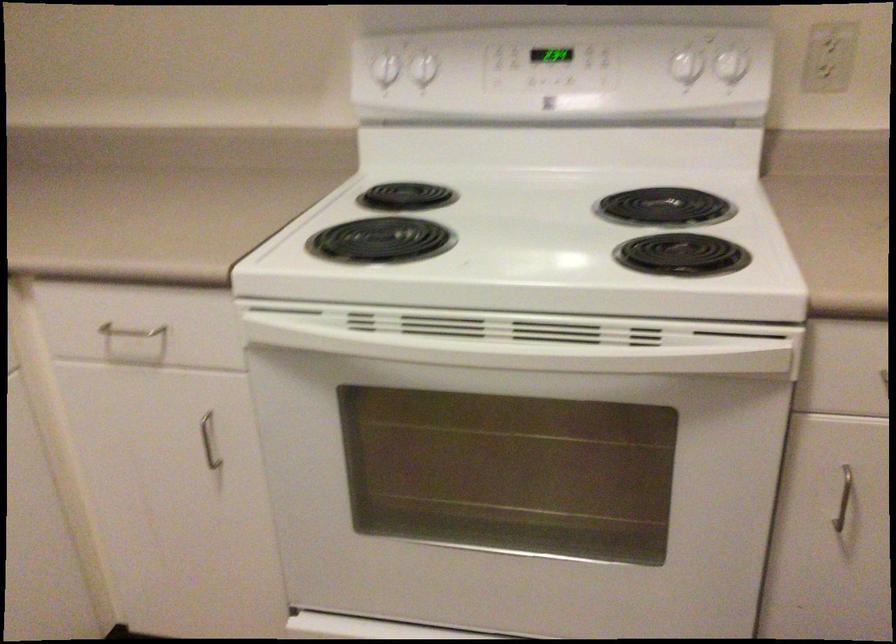
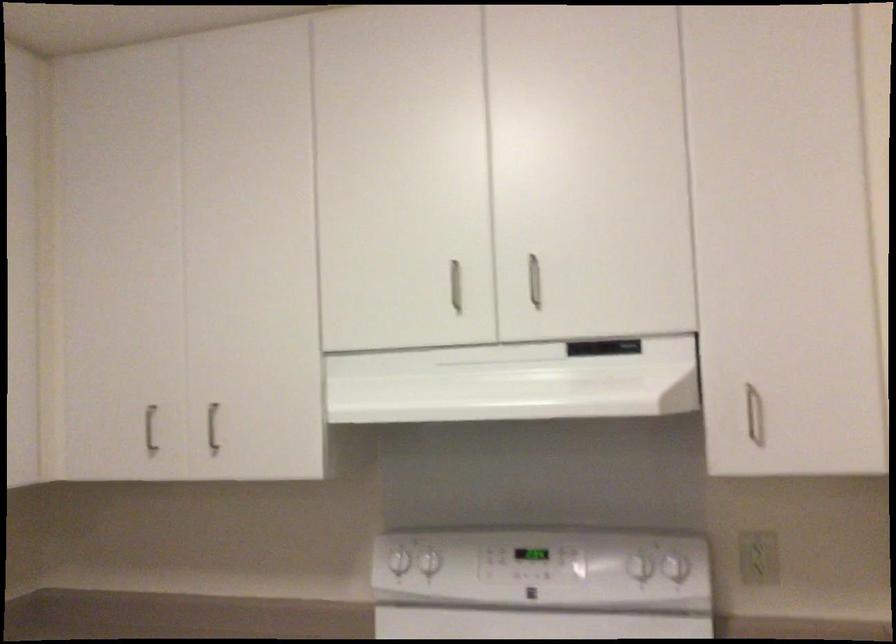
Question: Which direction would the cameraman need to move to produce the second image? Reply with the corresponding letter.

Choices:
 (A) Left
 (B) Right
 (C) Forward
 (D) Backward

Answer: (D)